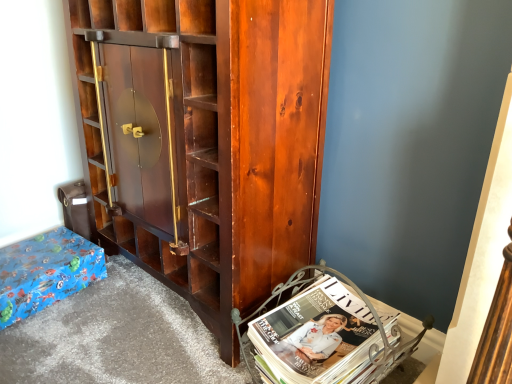
Question: From a real-world perspective, does blue wrapping paper at lower left stand above shiny dark wood cabinet at center?

Choices:
 (A) no
 (B) yes

Answer: (A)

Question: From a real-world perspective, does blue wrapping paper at lower left sit lower than shiny dark wood cabinet at center?

Choices:
 (A) no
 (B) yes

Answer: (B)

Question: Is blue wrapping paper at lower left facing away from shiny dark wood cabinet at center?

Choices:
 (A) no
 (B) yes

Answer: (A)

Question: From the image's perspective, is blue wrapping paper at lower left beneath shiny dark wood cabinet at center?

Choices:
 (A) yes
 (B) no

Answer: (A)

Question: Does blue wrapping paper at lower left have a lesser height compared to shiny dark wood cabinet at center?

Choices:
 (A) yes
 (B) no

Answer: (A)

Question: Is blue wrapping paper at lower left to the left or to the right of white glossy magazine at lower right in the image?

Choices:
 (A) left
 (B) right

Answer: (A)

Question: Is blue wrapping paper at lower left wider or thinner than white glossy magazine at lower right?

Choices:
 (A) wide
 (B) thin

Answer: (B)

Question: From a real-world perspective, is blue wrapping paper at lower left positioned above or below white glossy magazine at lower right?

Choices:
 (A) above
 (B) below

Answer: (B)

Question: Considering the positions of blue wrapping paper at lower left and white glossy magazine at lower right in the image, is blue wrapping paper at lower left bigger or smaller than white glossy magazine at lower right?

Choices:
 (A) big
 (B) small

Answer: (B)

Question: Is point (262, 372) positioned closer to the camera than point (3, 312)?

Choices:
 (A) closer
 (B) farther

Answer: (A)

Question: Looking at their shapes, would you say white glossy magazine at lower right is wider or thinner than blue wrapping paper at lower left?

Choices:
 (A) wide
 (B) thin

Answer: (A)

Question: From a real-world perspective, relative to blue wrapping paper at lower left, is white glossy magazine at lower right vertically above or below?

Choices:
 (A) above
 (B) below

Answer: (A)

Question: From the image's perspective, is white glossy magazine at lower right located above or below blue wrapping paper at lower left?

Choices:
 (A) above
 (B) below

Answer: (B)

Question: From their relative heights in the image, would you say shiny dark wood cabinet at center is taller or shorter than white glossy magazine at lower right?

Choices:
 (A) tall
 (B) short

Answer: (A)

Question: Is shiny dark wood cabinet at center inside or outside of white glossy magazine at lower right?

Choices:
 (A) outside
 (B) inside

Answer: (A)